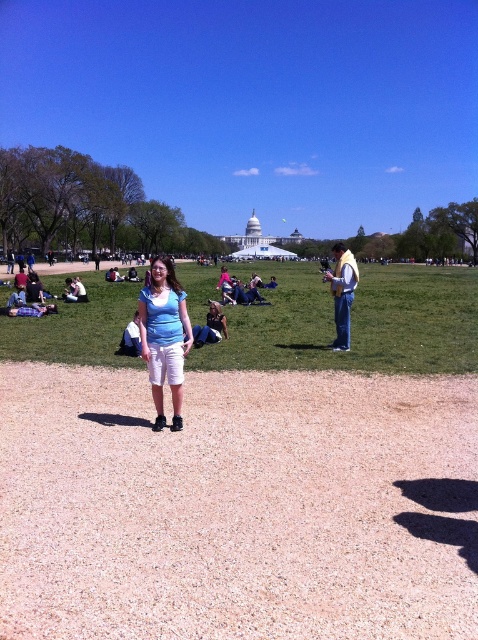
Question: Considering the real-world distances, which object is closest to the matte blue shirt at center?

Choices:
 (A) brown gravel at center
 (B) green grass at center

Answer: (A)

Question: Which object is closer to the camera taking this photo?

Choices:
 (A) green grass at center
 (B) brown gravel at center

Answer: (B)

Question: Is matte blue shirt at center below yellow fabric scarf at right?

Choices:
 (A) no
 (B) yes

Answer: (B)

Question: Which of the following is the farthest from the observer?

Choices:
 (A) (289, 308)
 (B) (151, 301)
 (C) (227, 596)
 (D) (337, 253)

Answer: (A)

Question: Does matte blue shirt at center come behind yellow fabric scarf at right?

Choices:
 (A) no
 (B) yes

Answer: (A)

Question: Is green grass at center positioned in front of yellow fabric scarf at right?

Choices:
 (A) yes
 (B) no

Answer: (A)